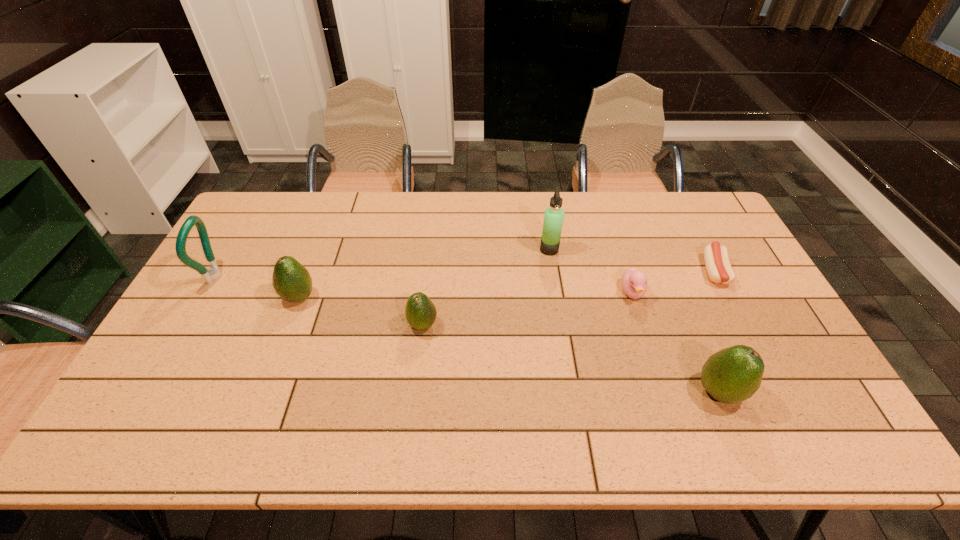
What are the coordinates of `the leftmost avocado` in the screenshot? It's located at (291, 280).

Locate an element on the screen. The height and width of the screenshot is (540, 960). the fourth tallest object is located at coordinates (291, 280).

Where is `the shortest avocado`? This screenshot has height=540, width=960. the shortest avocado is located at coordinates (420, 311).

At what (x,y) coordinates should I click in order to perform the action: click on the third shortest object. Please return your answer as a coordinate pair (x, y). This screenshot has height=540, width=960. Looking at the image, I should click on (420, 311).

Where is `the sixth object from left to right`? This screenshot has height=540, width=960. the sixth object from left to right is located at coordinates (732, 375).

This screenshot has width=960, height=540. I want to click on the nearest avocado, so click(732, 375).

Identify the location of duckling. (634, 282).

Where is `the fifth object from left to right`? This screenshot has height=540, width=960. the fifth object from left to right is located at coordinates (634, 282).

You are a GUI agent. You are given a task and a screenshot of the screen. Output one action in this format:
    pyautogui.click(x=<x>, y=<y>)
    Task: Click on the fourth object from left to right
    This screenshot has width=960, height=540.
    Given the screenshot: What is the action you would take?
    pyautogui.click(x=553, y=219)

Identify the location of the leftmost object. The height and width of the screenshot is (540, 960). [x=213, y=273].